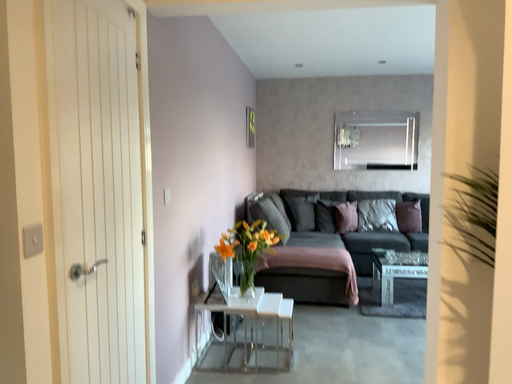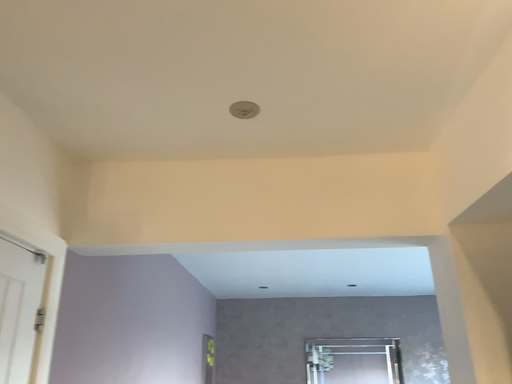
Question: How did the camera likely rotate when shooting the video?

Choices:
 (A) rotated upward
 (B) rotated downward

Answer: (A)